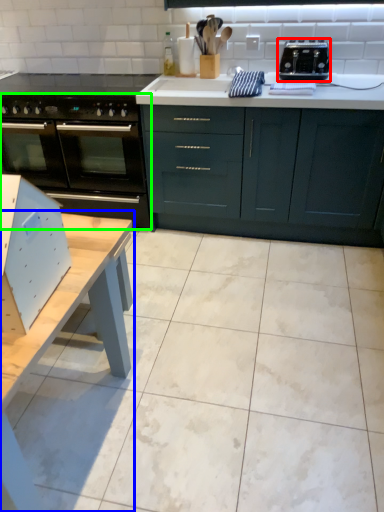
Question: Which object is positioned farthest from toaster (highlighted by a red box)? Select from table (highlighted by a blue box) and oven (highlighted by a green box).

Choices:
 (A) table
 (B) oven

Answer: (A)